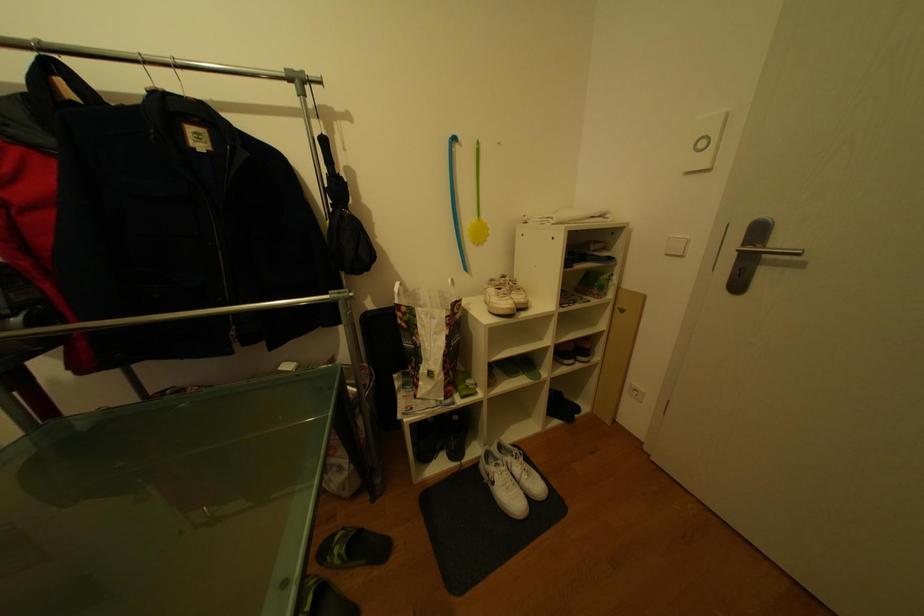
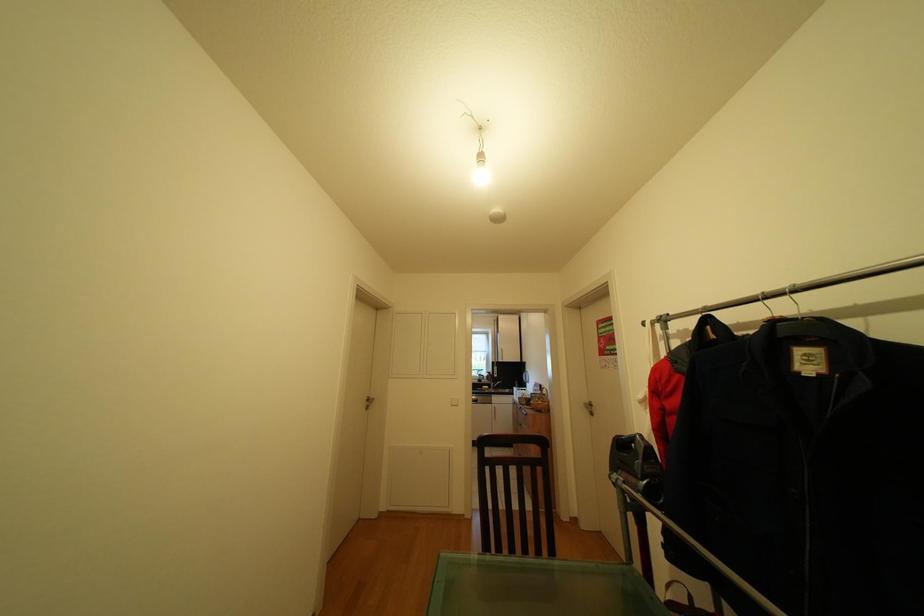
Question: The camera is either moving clockwise (left) or counter-clockwise (right) around the object. The first image is from the beginning of the video and the second image is from the end. Is the camera moving left or right when shooting the video?

Choices:
 (A) Left
 (B) Right

Answer: (B)